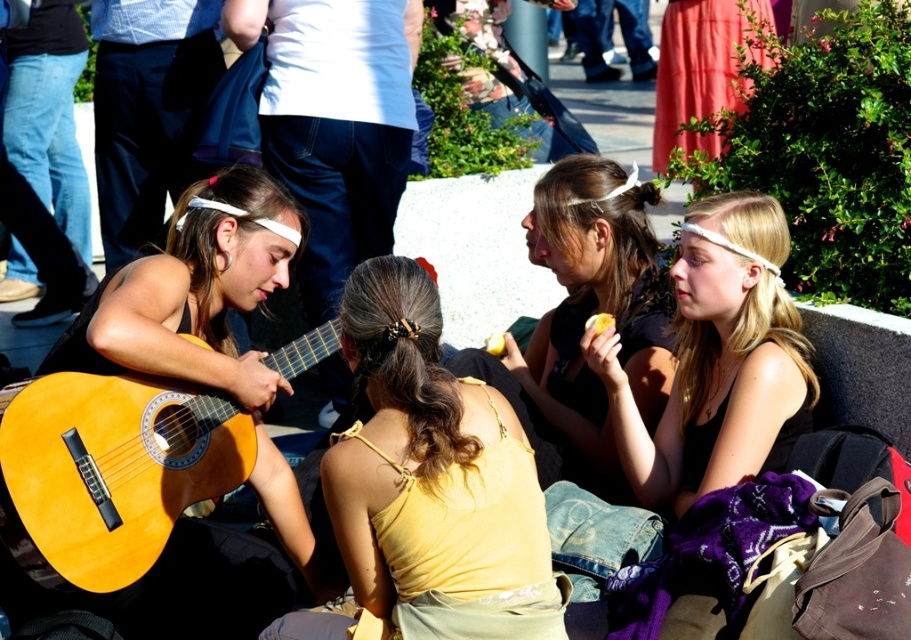
Between point (398, 465) and point (715, 333), which one is positioned in front?

Positioned in front is point (398, 465).

Is yellow fabric top at center bigger than matte black tank top at upper right?

Actually, yellow fabric top at center might be smaller than matte black tank top at upper right.

The width and height of the screenshot is (911, 640). I want to click on yellow fabric top at center, so click(428, 486).

Is yellow fabric top at center wider than matte black shirt at center?

Yes, yellow fabric top at center is wider than matte black shirt at center.

Does point (398, 541) come behind point (589, 205)?

No, it is not.

Identify the location of yellow fabric top at center. (428, 486).

Can you confirm if matte black tank top at upper right is positioned above matte black shirt at center?

Actually, matte black tank top at upper right is below matte black shirt at center.

The height and width of the screenshot is (640, 911). I want to click on matte black tank top at upper right, so click(697, 388).

Is point (768, 285) behind point (549, 221)?

No, (768, 285) is closer to viewer.

I want to click on matte black tank top at upper right, so click(x=697, y=388).